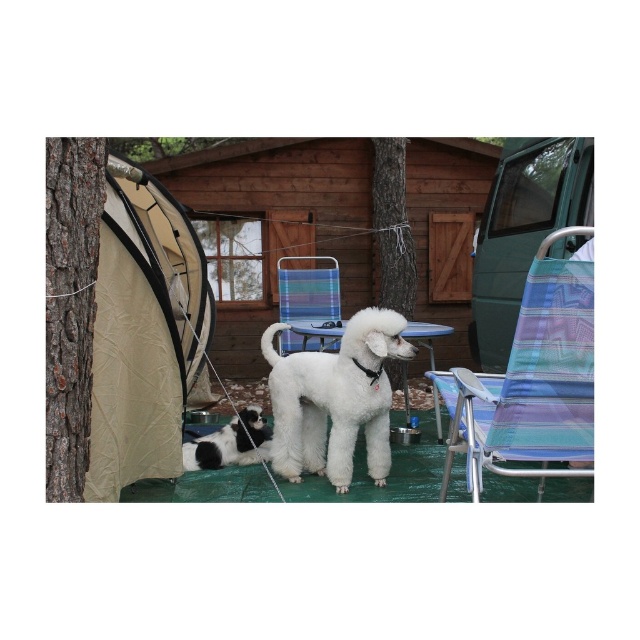
You are a hiker who wants to take a photo of the wooden cabin at center and the white fluffy dog at center from your current position. Can you see both objects in the same frame without moving your camera?

The wooden cabin at center is above the white fluffy dog at center, so yes, you can see both in the same frame as the cabin is positioned higher up while the dog is lower down.

You are setting up a campsite and need to place the multicolored fabric chair at center and the brown rough bark at upper center. According to the scene, which object is positioned to the right of the other?

The multicolored fabric chair at center is to the right of brown rough bark at upper center.

You are planning to take a photo of the multicolored fabric chair at center and the brown rough bark at upper center. Which object will appear closer to the camera in the photo?

The multicolored fabric chair at center will appear closer to the camera because it is in front of the brown rough bark at upper center.